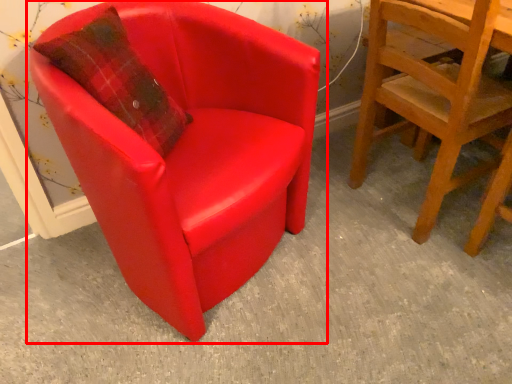
Question: From the image's perspective, where is chair (annotated by the red box) located in relation to chair in the image?

Choices:
 (A) above
 (B) below

Answer: (B)